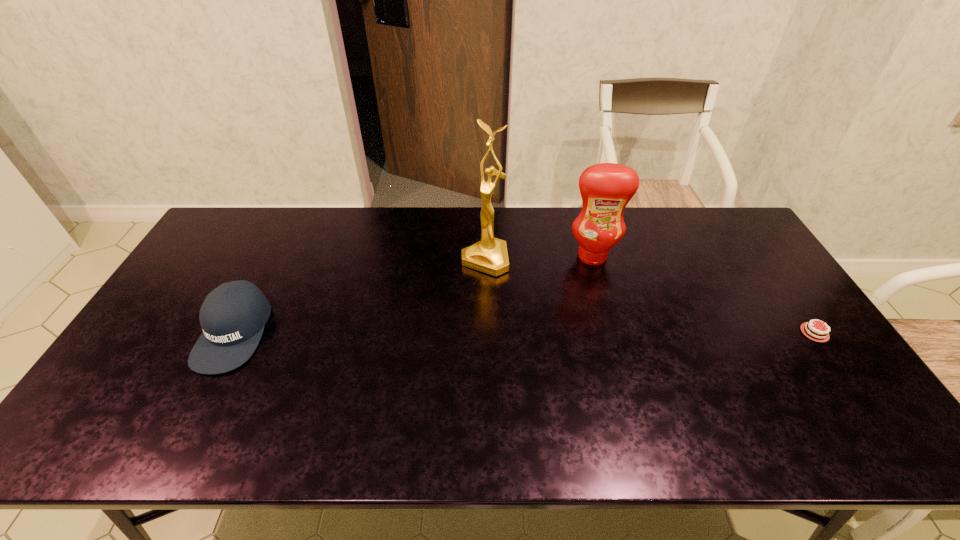
The image size is (960, 540). I want to click on vacant space at the near edge, so click(x=595, y=381).

In the image, there is a desktop. Identify the location of vacant space at the far left corner. This screenshot has width=960, height=540. (234, 209).

At what (x,y) coordinates should I click in order to perform the action: click on free space at the far right corner of the desktop. Please return your answer as a coordinate pair (x, y). Image resolution: width=960 pixels, height=540 pixels. Looking at the image, I should click on (704, 213).

This screenshot has height=540, width=960. What are the coordinates of `free area in between the second object from left to right and the chocolate cake` in the screenshot? It's located at (650, 296).

Where is `free space between the second shortest object and the rightmost object`? This screenshot has height=540, width=960. free space between the second shortest object and the rightmost object is located at coordinates (524, 333).

This screenshot has height=540, width=960. I want to click on vacant point located between the second object from right to left and the tallest object, so click(539, 258).

Locate an element on the screen. The image size is (960, 540). empty space that is in between the third object from right to left and the rightmost object is located at coordinates (650, 296).

I want to click on vacant space that's between the rightmost object and the second tallest object, so click(704, 294).

What are the coordinates of `vacant region between the third tallest object and the tallest object` in the screenshot? It's located at (359, 296).

Identify the location of empty location between the shortest object and the leftmost object. (524, 333).